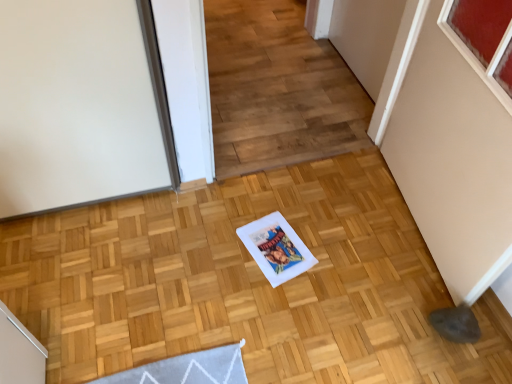
The image size is (512, 384). Find the location of `vacant space that is to the left of white glossy postcard at center`. vacant space that is to the left of white glossy postcard at center is located at coordinates (220, 250).